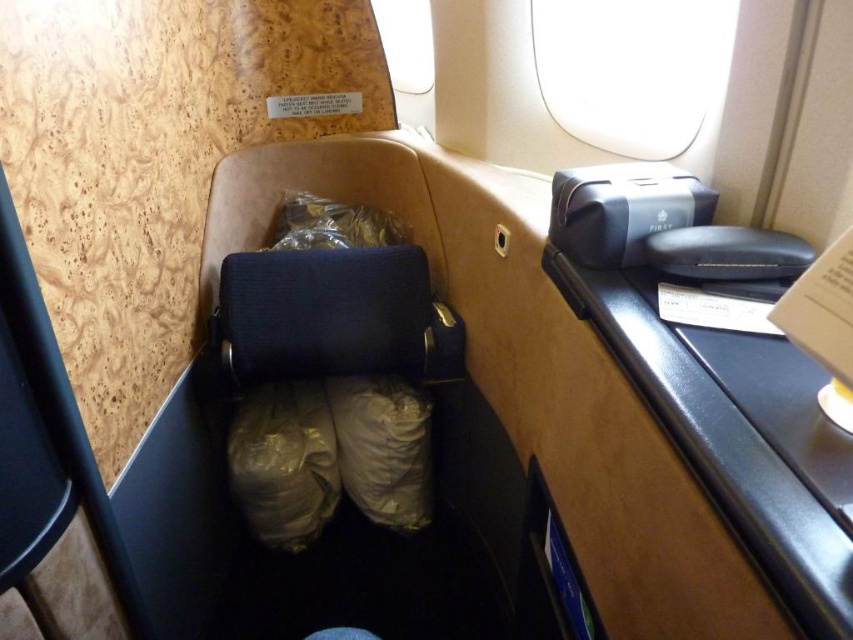
Question: Considering the real-world distances, which object is farthest from the matte black case at upper right?

Choices:
 (A) shiny plastic bag at center
 (B) matte beige bag at center

Answer: (A)

Question: Can you confirm if matte beige bag at center is positioned to the right of matte black case at upper right?

Choices:
 (A) yes
 (B) no

Answer: (B)

Question: Can you confirm if matte black case at upper right is smaller than shiny gold bag at center?

Choices:
 (A) no
 (B) yes

Answer: (A)

Question: Can you confirm if matte beige bag at center is positioned to the right of matte black case at upper right?

Choices:
 (A) no
 (B) yes

Answer: (A)

Question: Which object is positioned farthest from the matte black case at upper right?

Choices:
 (A) shiny plastic bag at center
 (B) shiny gold bag at center
 (C) matte beige bag at center

Answer: (A)

Question: Among these objects, which one is farthest from the camera?

Choices:
 (A) shiny gold bag at center
 (B) matte beige bag at center
 (C) matte black case at upper right
 (D) shiny plastic bag at center

Answer: (A)